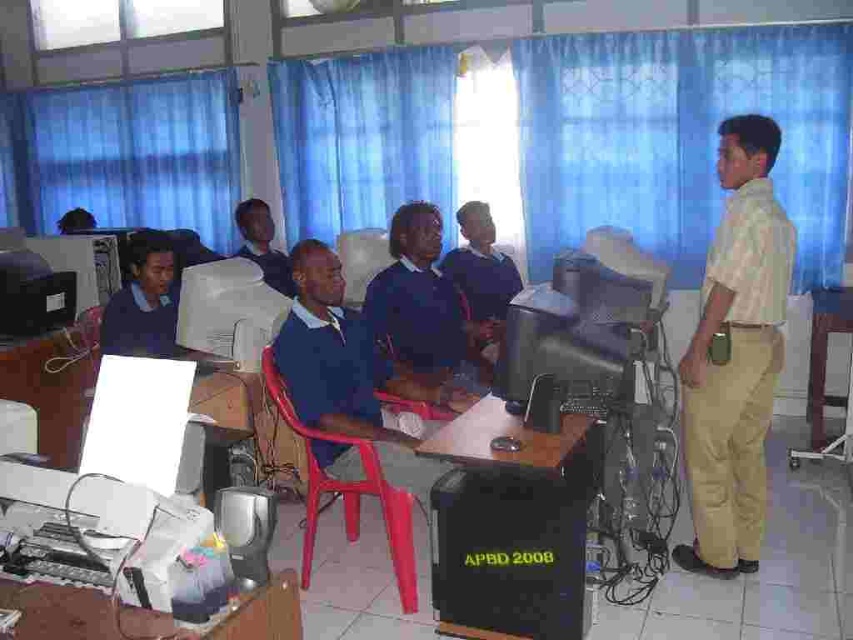
In the classroom scene, you see a white textured shirt at right and a white plastic printer at lower left. Which object is positioned to the right of the other?

The white textured shirt at right is positioned to the right of the white plastic printer at lower left.

You are a delivery person who needs to place a package between the white textured shirt at right and the white plastic printer at lower left. The package is 8 feet long. Can you fit it between them?

The distance between the white textured shirt at right and the white plastic printer at lower left is 7.51 feet. Since the package is 8 feet long, it cannot fit between them as the space is slightly shorter than the package.

You are a student in the classroom and need to hand in a document. The white plastic printer at lower left is where you usually submit your work. However, there is a person wearing a white textured shirt at right blocking your path. Can you still reach the printer without moving the person?

The white textured shirt at right is much taller than the white plastic printer at lower left, so the person wearing the white textured shirt at right is likely blocking the path to the printer. You may need to ask them to move or find an alternative route.